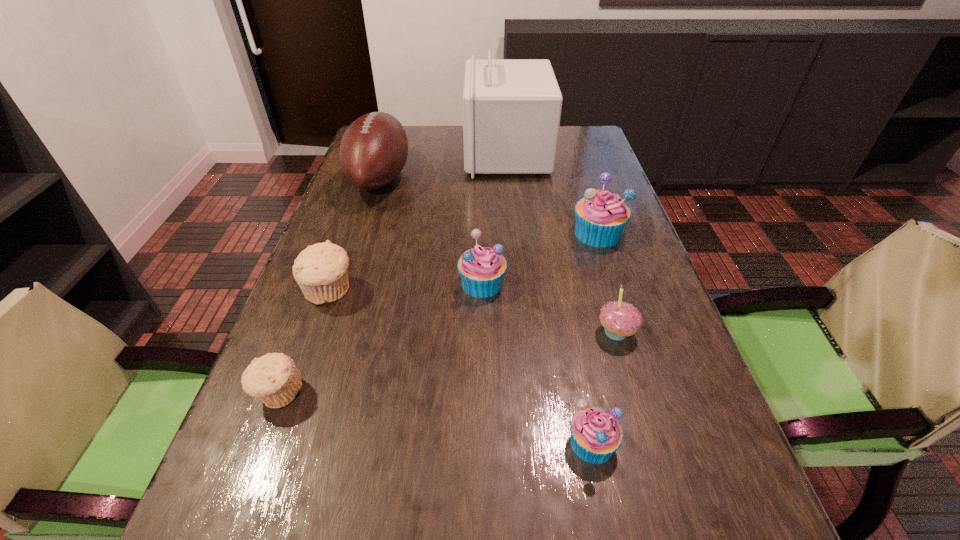
Locate an element on the screen. cupcake is located at coordinates (620, 319).

Locate an element on the screen. This screenshot has width=960, height=540. the nearest muffin is located at coordinates (596, 434).

This screenshot has width=960, height=540. I want to click on the nearest object, so point(596,434).

Find the location of `the nearer beige muffin`. the nearer beige muffin is located at coordinates (273, 378).

Locate an element on the screen. This screenshot has height=540, width=960. the seventh farthest object is located at coordinates (273, 378).

I want to click on vacant position located 0.250m on the front-facing side of the first-aid kit, so click(390, 153).

Locate an element on the screen. The width and height of the screenshot is (960, 540). free space located 0.300m on the front-facing side of the first-aid kit is located at coordinates (374, 153).

You are a GUI agent. You are given a task and a screenshot of the screen. Output one action in this format:
    pyautogui.click(x=<x>, y=<y>)
    Task: Click on the vacant region located 0.290m on the front-facing side of the first-aid kit
    Image resolution: width=960 pixels, height=540 pixels.
    Given the screenshot: What is the action you would take?
    [378, 153]

Where is `vacant space located 0.250m on the right of the brown football (American)`? The image size is (960, 540). vacant space located 0.250m on the right of the brown football (American) is located at coordinates (492, 178).

Where is `free space located 0.130m on the front of the biggest blue muffin`? free space located 0.130m on the front of the biggest blue muffin is located at coordinates (614, 287).